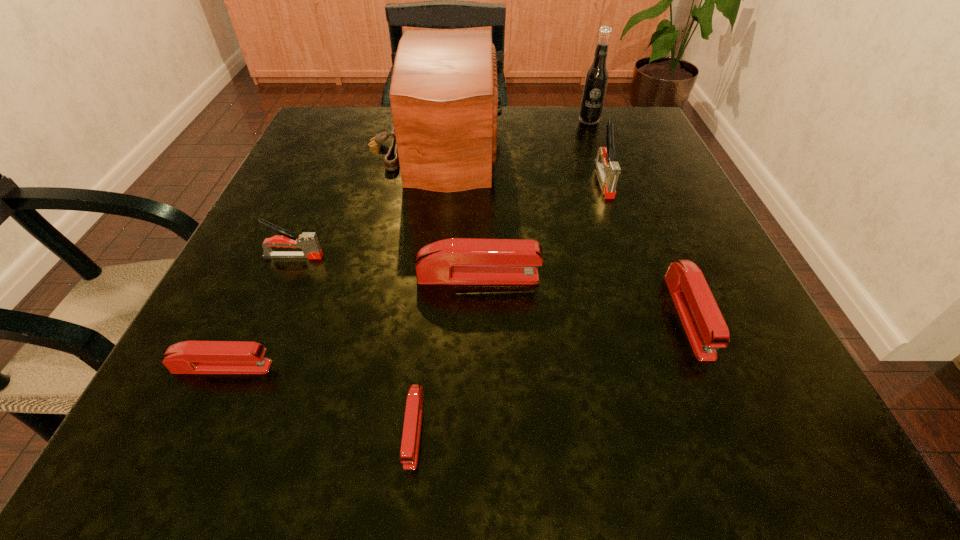
This screenshot has height=540, width=960. Find the location of `free point that satisfies the following two spatial constraints: 1. on the label of the root beer; 2. on the front-facing side of the radio receiver`. free point that satisfies the following two spatial constraints: 1. on the label of the root beer; 2. on the front-facing side of the radio receiver is located at coordinates (598, 145).

Find the location of a particular element. The image size is (960, 540). free location that satisfies the following two spatial constraints: 1. on the front-facing side of the biggest red stapler; 2. on the front-facing side of the nearest red stapler is located at coordinates (477, 429).